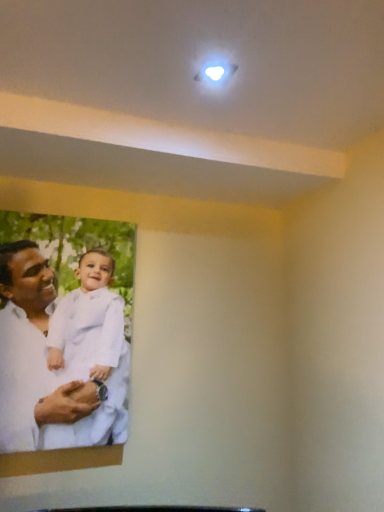
What do you see at coordinates (33, 359) in the screenshot? I see `white matte/soft fabric man at lower left` at bounding box center [33, 359].

Consider the image. Measure the distance between white matte/soft fabric man at lower left and camera.

The depth of white matte/soft fabric man at lower left is 4.29 feet.

Measure the distance between point (51, 389) and camera.

Point (51, 389) and camera are 1.37 meters apart from each other.

At what (x,y) coordinates should I click in order to perform the action: click on white matte/soft fabric man at lower left. Please return your answer as a coordinate pair (x, y). The image size is (384, 512). Looking at the image, I should click on coord(33,359).

Where is `white matte/soft fabric man at lower left`? The image size is (384, 512). white matte/soft fabric man at lower left is located at coordinates (33, 359).